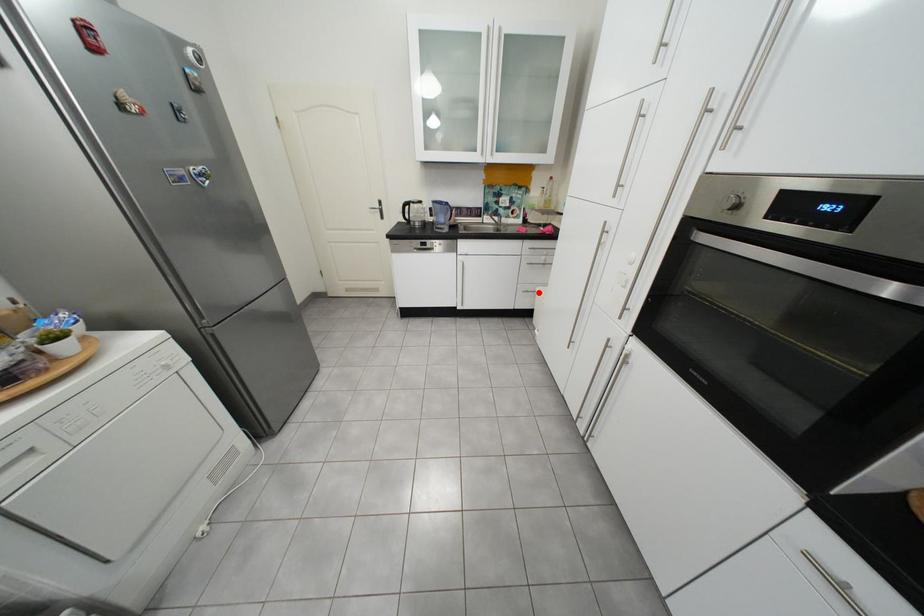
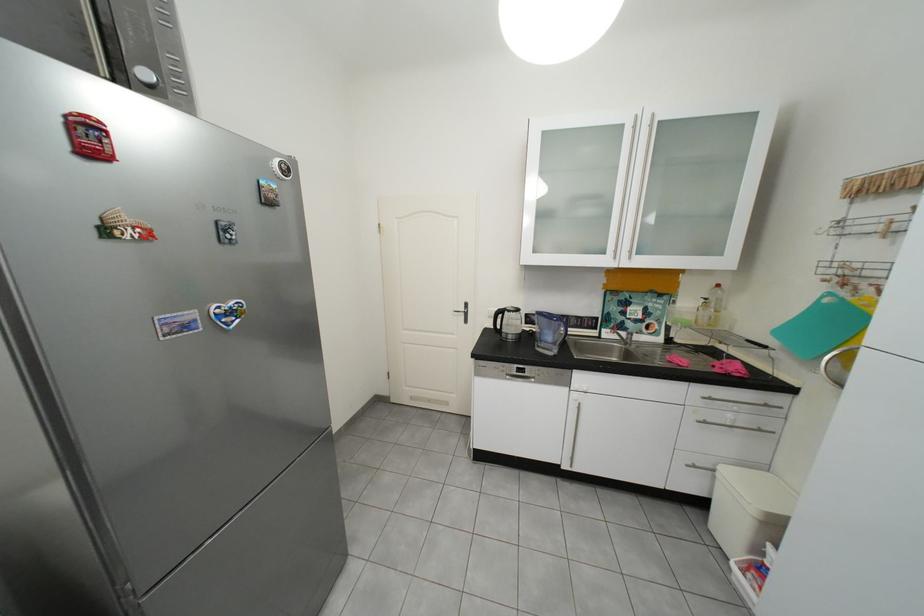
In the second image, find the point that corresponds to the highlighted location in the first image.

(707, 468)